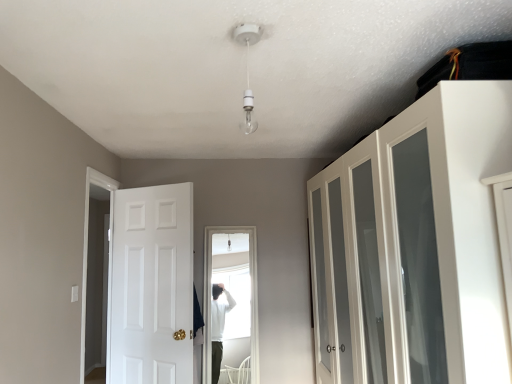
Question: Would you say white glossy door at left is inside or outside white glass cabinet at upper right?

Choices:
 (A) inside
 (B) outside

Answer: (B)

Question: Visually, is white glossy door at left positioned to the left or to the right of white glass cabinet at upper right?

Choices:
 (A) right
 (B) left

Answer: (B)

Question: Considering their positions, is white glossy door at left located in front of or behind white glass cabinet at upper right?

Choices:
 (A) front
 (B) behind

Answer: (B)

Question: Is white glass cabinet at upper right spatially inside white glossy door at left, or outside of it?

Choices:
 (A) outside
 (B) inside

Answer: (A)

Question: Considering the relative positions of white glass cabinet at upper right and white glossy door at left in the image provided, is white glass cabinet at upper right to the left or to the right of white glossy door at left?

Choices:
 (A) left
 (B) right

Answer: (B)

Question: Is point (334, 271) positioned closer to the camera than point (173, 319)?

Choices:
 (A) farther
 (B) closer

Answer: (B)

Question: From the image's perspective, is white glass cabinet at upper right above or below white glossy door at left?

Choices:
 (A) above
 (B) below

Answer: (A)